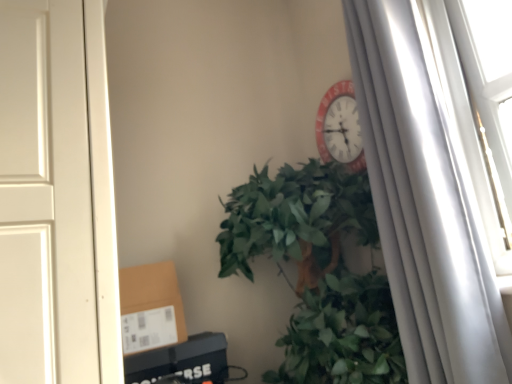
Question: Is green leafy plant at center facing towards white matte curtain at right?

Choices:
 (A) yes
 (B) no

Answer: (A)

Question: Is green leafy plant at center positioned behind white matte curtain at right?

Choices:
 (A) no
 (B) yes

Answer: (A)

Question: From the image's perspective, is green leafy plant at center under white matte curtain at right?

Choices:
 (A) no
 (B) yes

Answer: (B)

Question: Does green leafy plant at center have a lesser width compared to white matte curtain at right?

Choices:
 (A) no
 (B) yes

Answer: (A)

Question: Does green leafy plant at center appear on the left side of white matte curtain at right?

Choices:
 (A) yes
 (B) no

Answer: (A)

Question: Can you confirm if green leafy plant at center is wider than white matte curtain at right?

Choices:
 (A) no
 (B) yes

Answer: (B)

Question: Does brown cardboard box at lower left lie in front of green leafy plant at center?

Choices:
 (A) yes
 (B) no

Answer: (B)

Question: Are brown cardboard box at lower left and green leafy plant at center making contact?

Choices:
 (A) no
 (B) yes

Answer: (A)

Question: Is brown cardboard box at lower left thinner than green leafy plant at center?

Choices:
 (A) yes
 (B) no

Answer: (A)

Question: Does brown cardboard box at lower left have a greater width compared to green leafy plant at center?

Choices:
 (A) yes
 (B) no

Answer: (B)

Question: Does brown cardboard box at lower left lie behind green leafy plant at center?

Choices:
 (A) no
 (B) yes

Answer: (B)

Question: Are brown cardboard box at lower left and green leafy plant at center far apart?

Choices:
 (A) no
 (B) yes

Answer: (A)

Question: Is green leafy plant at center further to the viewer compared to brown cardboard box at lower left?

Choices:
 (A) yes
 (B) no

Answer: (B)